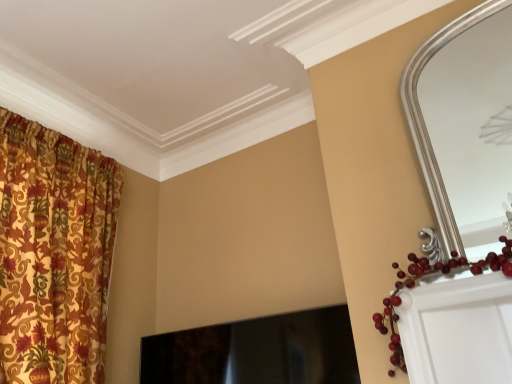
Question: Considering the positions of silver metallic mirror at upper right and black glossy fireplace at center in the image, is silver metallic mirror at upper right wider or thinner than black glossy fireplace at center?

Choices:
 (A) wide
 (B) thin

Answer: (B)

Question: Is silver metallic mirror at upper right bigger or smaller than black glossy fireplace at center?

Choices:
 (A) big
 (B) small

Answer: (B)

Question: Is silver metallic mirror at upper right spatially inside black glossy fireplace at center, or outside of it?

Choices:
 (A) inside
 (B) outside

Answer: (B)

Question: In the image, is black glossy fireplace at center on the left side or the right side of silver metallic mirror at upper right?

Choices:
 (A) right
 (B) left

Answer: (B)

Question: Considering the positions of black glossy fireplace at center and silver metallic mirror at upper right in the image, is black glossy fireplace at center bigger or smaller than silver metallic mirror at upper right?

Choices:
 (A) small
 (B) big

Answer: (B)

Question: From a real-world perspective, relative to silver metallic mirror at upper right, is black glossy fireplace at center vertically above or below?

Choices:
 (A) above
 (B) below

Answer: (B)

Question: Considering the positions of point (244, 336) and point (487, 91), is point (244, 336) closer or farther from the camera than point (487, 91)?

Choices:
 (A) farther
 (B) closer

Answer: (B)